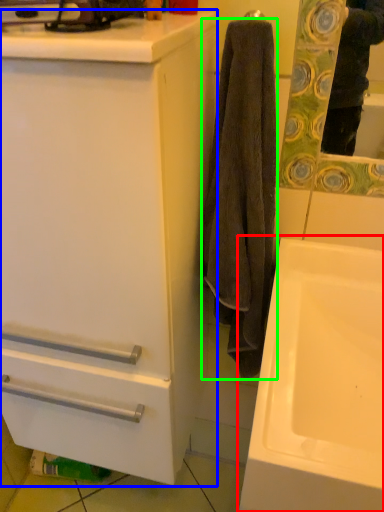
Question: Considering the real-world distances, which object is farthest from sink (highlighted by a red box)? bathroom cabinet (highlighted by a blue box) or towel/napkin (highlighted by a green box)?

Choices:
 (A) bathroom cabinet
 (B) towel/napkin

Answer: (A)